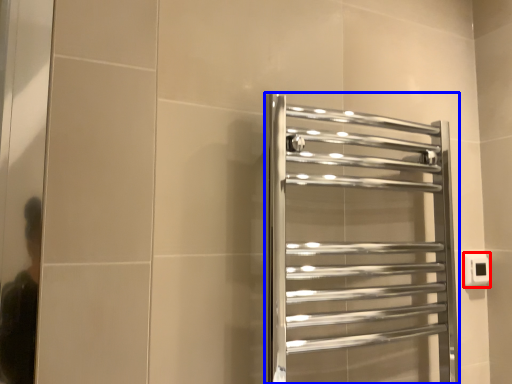
Question: Which of the following is the farthest to the observer, electric outlet (highlighted by a red box) or towel rack (highlighted by a blue box)?

Choices:
 (A) electric outlet
 (B) towel rack

Answer: (A)